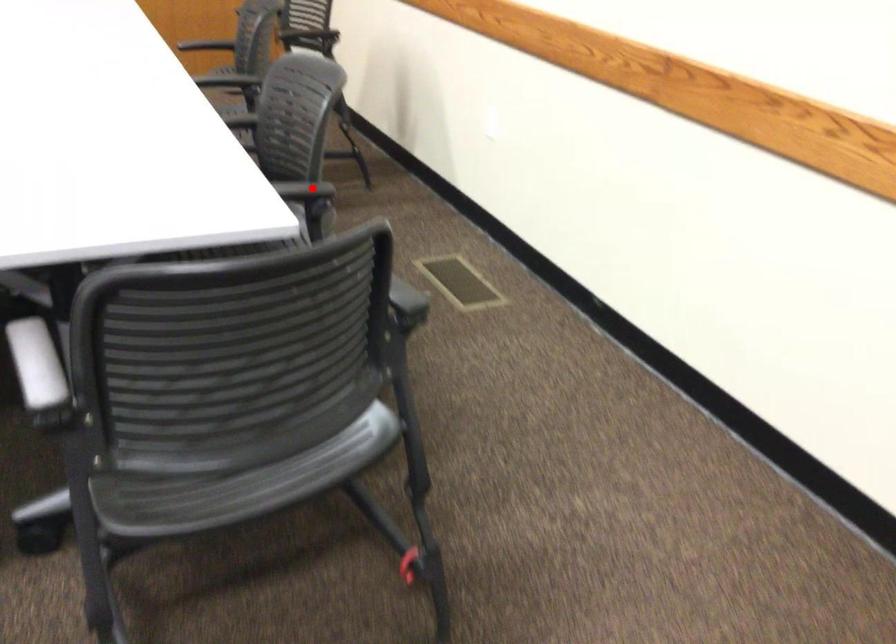
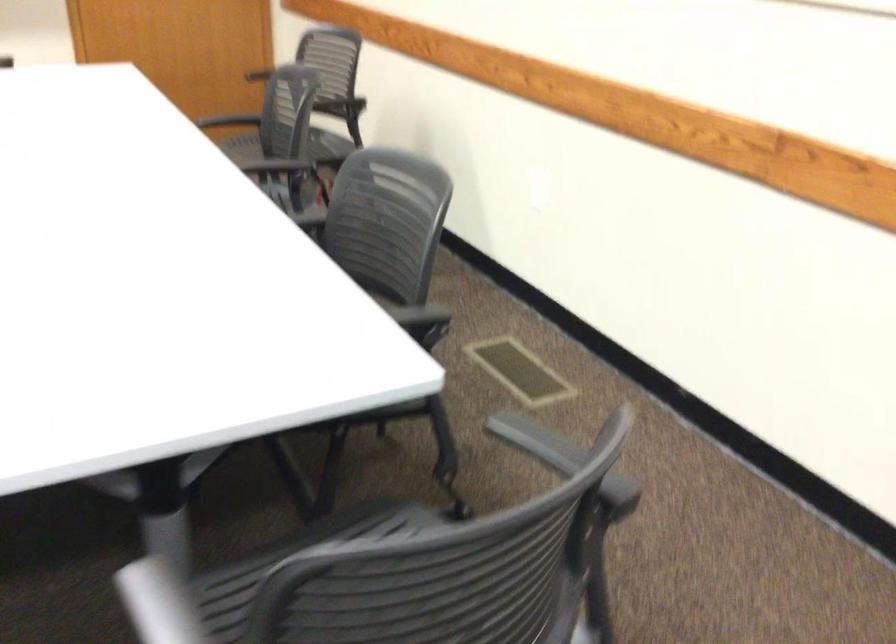
Question: I am providing you with two images of the same scene from different viewpoints. A red point is marked on the first image. Is the red point's position out of view in image 2?

Choices:
 (A) Yes
 (B) No

Answer: (B)